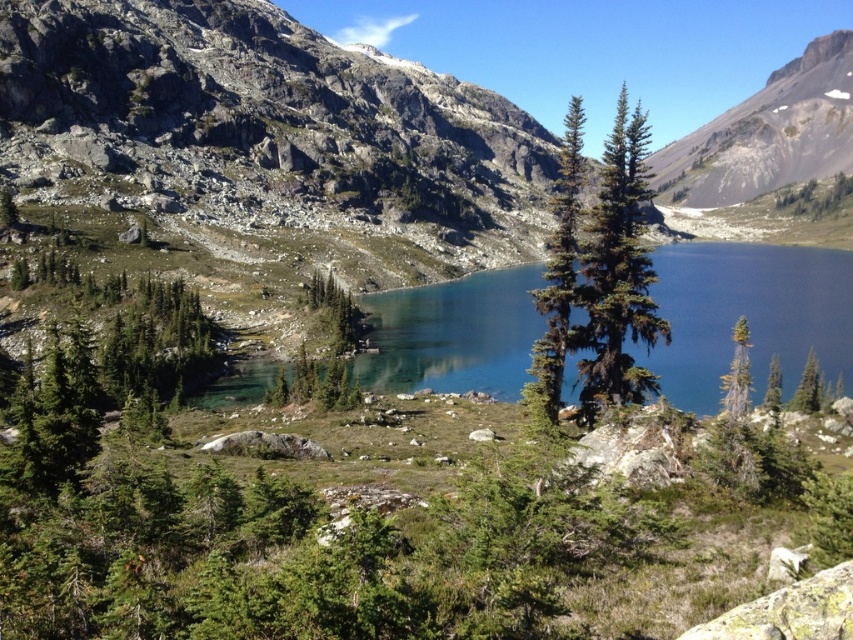
Consider the image. Which of these two, green matte tree at right or green matte tree at center-right, stands shorter?

green matte tree at center-right

From the picture: Can you confirm if green matte tree at right is wider than green matte tree at center-right?

No, green matte tree at right is not wider than green matte tree at center-right.

Which is in front, point (816, 397) or point (764, 396)?

Positioned in front is point (764, 396).

This screenshot has height=640, width=853. Find the location of `green matte tree at right`. green matte tree at right is located at coordinates (807, 387).

Based on the photo, is rugged granite mountain at upper center below green needle-like tree at center?

No.

Who is more distant from viewer, (x=70, y=152) or (x=570, y=342)?

Point (x=70, y=152)

This screenshot has height=640, width=853. What are the coordinates of `rugged granite mountain at upper center` in the screenshot? It's located at (270, 125).

Is point (456, 132) more distant than point (488, 296)?

Yes, point (456, 132) is behind point (488, 296).

Is rugged granite mountain at upper center closer to camera compared to clear glass water at center?

No, it is behind clear glass water at center.

Image resolution: width=853 pixels, height=640 pixels. Find the location of `rugged granite mountain at upper center`. rugged granite mountain at upper center is located at coordinates (270, 125).